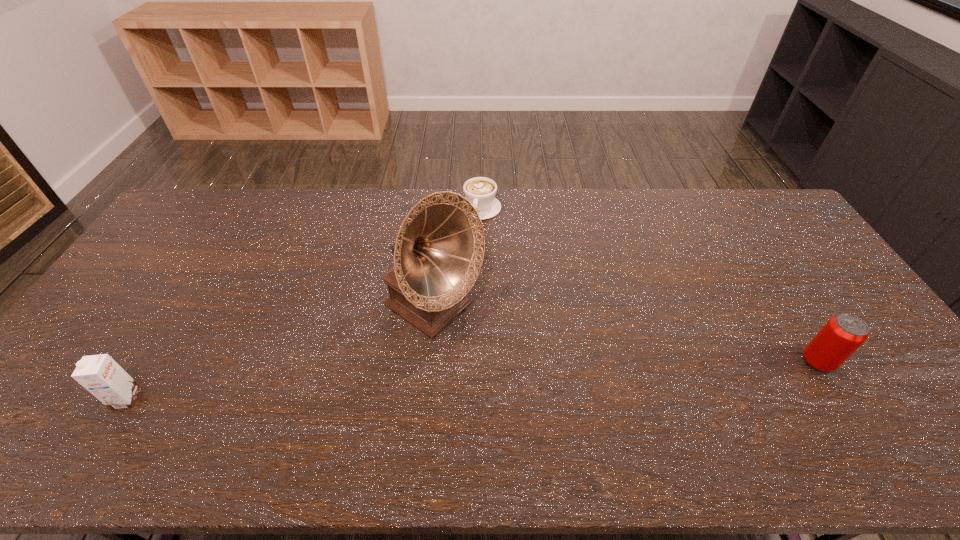
Identify the location of the leftmost object. (99, 374).

You are a GUI agent. You are given a task and a screenshot of the screen. Output one action in this format:
    pyautogui.click(x=<x>, y=<y>)
    Task: Click on the chocolate milk
    
    Given the screenshot: What is the action you would take?
    pyautogui.click(x=99, y=374)

This screenshot has width=960, height=540. I want to click on can, so click(843, 334).

Image resolution: width=960 pixels, height=540 pixels. In order to click on phonograph record in this screenshot , I will do `click(439, 250)`.

Where is `cappuccino`? cappuccino is located at coordinates (480, 191).

Find the location of a particular element. This screenshot has width=960, height=540. the shortest object is located at coordinates (480, 191).

Locate an element on the screen. This screenshot has width=960, height=540. free space located on the right of the chocolate milk is located at coordinates (172, 399).

Locate an element on the screen. The width and height of the screenshot is (960, 540). vacant space located 0.100m on the back of the rightmost object is located at coordinates (791, 320).

Identify the location of vacant region located on the horn of the tallest object. (585, 414).

The image size is (960, 540). Identify the location of vacant space located 0.120m on the horn of the tallest object. (508, 361).